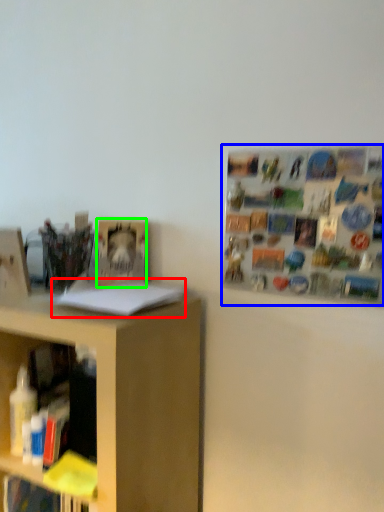
Question: Which is farther away from book (highlighted by a red box)? bulletin board (highlighted by a blue box) or book (highlighted by a green box)?

Choices:
 (A) bulletin board
 (B) book

Answer: (A)